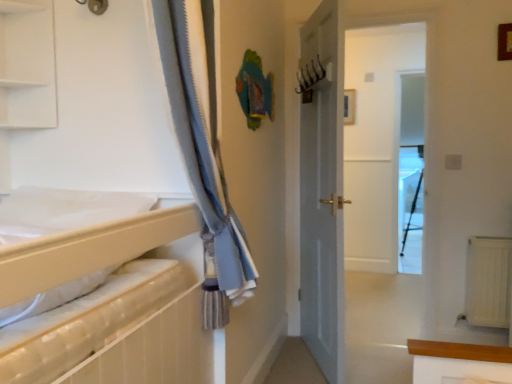
Question: Is wooden picture frame at upper right surrounded by transparent glass screen door at center?

Choices:
 (A) no
 (B) yes

Answer: (A)

Question: Considering the relative sizes of transparent glass screen door at center and wooden picture frame at upper right in the image provided, is transparent glass screen door at center thinner than wooden picture frame at upper right?

Choices:
 (A) yes
 (B) no

Answer: (B)

Question: Is transparent glass screen door at center taller than wooden picture frame at upper right?

Choices:
 (A) yes
 (B) no

Answer: (A)

Question: Is transparent glass screen door at center shorter than wooden picture frame at upper right?

Choices:
 (A) yes
 (B) no

Answer: (B)

Question: Does transparent glass screen door at center touch wooden picture frame at upper right?

Choices:
 (A) no
 (B) yes

Answer: (A)

Question: Does transparent glass screen door at center have a larger size compared to wooden picture frame at upper right?

Choices:
 (A) yes
 (B) no

Answer: (A)

Question: Does transparent glass screen door at center contain white matte shelf at upper left?

Choices:
 (A) no
 (B) yes

Answer: (A)

Question: Does transparent glass screen door at center have a lesser width compared to white matte shelf at upper left?

Choices:
 (A) yes
 (B) no

Answer: (A)

Question: Does transparent glass screen door at center appear on the right side of white matte shelf at upper left?

Choices:
 (A) yes
 (B) no

Answer: (A)

Question: Considering the relative positions of transparent glass screen door at center and white matte shelf at upper left in the image provided, is transparent glass screen door at center behind white matte shelf at upper left?

Choices:
 (A) yes
 (B) no

Answer: (A)

Question: Could you tell me if transparent glass screen door at center is facing white matte shelf at upper left?

Choices:
 (A) yes
 (B) no

Answer: (B)

Question: From the image's perspective, is transparent glass screen door at center on white matte shelf at upper left?

Choices:
 (A) no
 (B) yes

Answer: (A)

Question: Is white matte shelf at upper left surrounding white matte sheet at left?

Choices:
 (A) yes
 (B) no

Answer: (B)